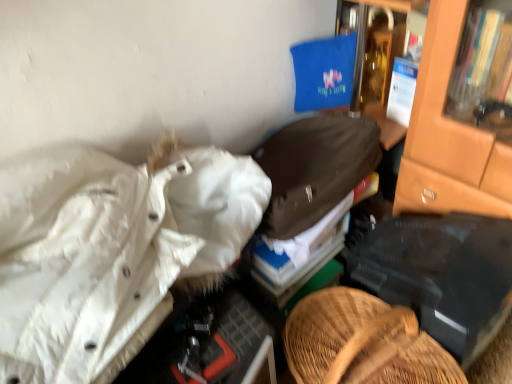
Question: In which direction should I rotate to look at brown fabric jacket at center, the 1th clothing when ordered from top to bottom?

Choices:
 (A) right
 (B) left

Answer: (A)

Question: Can you confirm if brown fabric jacket at center, the 1th clothing when ordered from top to bottom, is taller than white puffy jacket at left, acting as the 1th clothing starting from the bottom?

Choices:
 (A) no
 (B) yes

Answer: (A)

Question: Considering the relative sizes of brown fabric jacket at center, placed as the second clothing when sorted from bottom to top, and white puffy jacket at left, acting as the 1th clothing starting from the bottom, in the image provided, is brown fabric jacket at center, placed as the second clothing when sorted from bottom to top, shorter than white puffy jacket at left, acting as the 1th clothing starting from the bottom,?

Choices:
 (A) no
 (B) yes

Answer: (B)

Question: Is white puffy jacket at left, acting as the 1th clothing starting from the bottom, completely or partially inside brown fabric jacket at center, placed as the second clothing when sorted from bottom to top?

Choices:
 (A) no
 (B) yes

Answer: (A)

Question: Considering the relative positions of brown fabric jacket at center, the 1th clothing when ordered from top to bottom, and white puffy jacket at left, acting as the 1th clothing starting from the bottom, in the image provided, is brown fabric jacket at center, the 1th clothing when ordered from top to bottom, in front of white puffy jacket at left, acting as the 1th clothing starting from the bottom,?

Choices:
 (A) no
 (B) yes

Answer: (A)

Question: Could you tell me if brown fabric jacket at center, placed as the second clothing when sorted from bottom to top, is turned towards white puffy jacket at left, acting as the 1th clothing starting from the bottom?

Choices:
 (A) yes
 (B) no

Answer: (B)

Question: Does brown fabric jacket at center, the 1th clothing when ordered from top to bottom, appear on the right side of white puffy jacket at left, acting as the 1th clothing starting from the bottom?

Choices:
 (A) no
 (B) yes

Answer: (B)

Question: Is white puffy jacket at left, acting as the 1th clothing starting from the bottom, smaller than brown fabric jacket at center, placed as the second clothing when sorted from bottom to top?

Choices:
 (A) no
 (B) yes

Answer: (A)

Question: Considering the relative positions of white puffy jacket at left, placed as the 2th clothing when sorted from top to bottom, and brown fabric jacket at center, the 1th clothing when ordered from top to bottom, in the image provided, is white puffy jacket at left, placed as the 2th clothing when sorted from top to bottom, behind brown fabric jacket at center, the 1th clothing when ordered from top to bottom,?

Choices:
 (A) no
 (B) yes

Answer: (A)

Question: Can you confirm if white puffy jacket at left, placed as the 2th clothing when sorted from top to bottom, is taller than brown fabric jacket at center, placed as the second clothing when sorted from bottom to top?

Choices:
 (A) yes
 (B) no

Answer: (A)

Question: Is white puffy jacket at left, placed as the 2th clothing when sorted from top to bottom, looking in the opposite direction of brown fabric jacket at center, the 1th clothing when ordered from top to bottom?

Choices:
 (A) yes
 (B) no

Answer: (B)

Question: Considering the relative sizes of white puffy jacket at left, placed as the 2th clothing when sorted from top to bottom, and brown fabric jacket at center, the 1th clothing when ordered from top to bottom, in the image provided, is white puffy jacket at left, placed as the 2th clothing when sorted from top to bottom, thinner than brown fabric jacket at center, the 1th clothing when ordered from top to bottom,?

Choices:
 (A) yes
 (B) no

Answer: (B)

Question: Does white puffy jacket at left, placed as the 2th clothing when sorted from top to bottom, have a lesser height compared to brown fabric jacket at center, placed as the second clothing when sorted from bottom to top?

Choices:
 (A) no
 (B) yes

Answer: (A)

Question: Based on their positions, is white puffy jacket at left, placed as the 2th clothing when sorted from top to bottom, located to the left or right of brown fabric jacket at center, placed as the second clothing when sorted from bottom to top?

Choices:
 (A) right
 (B) left

Answer: (B)